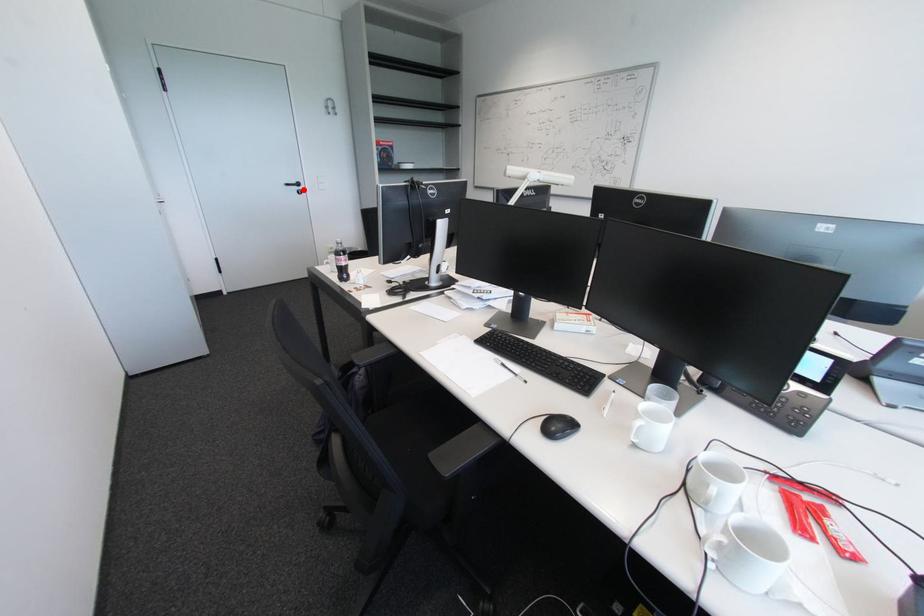
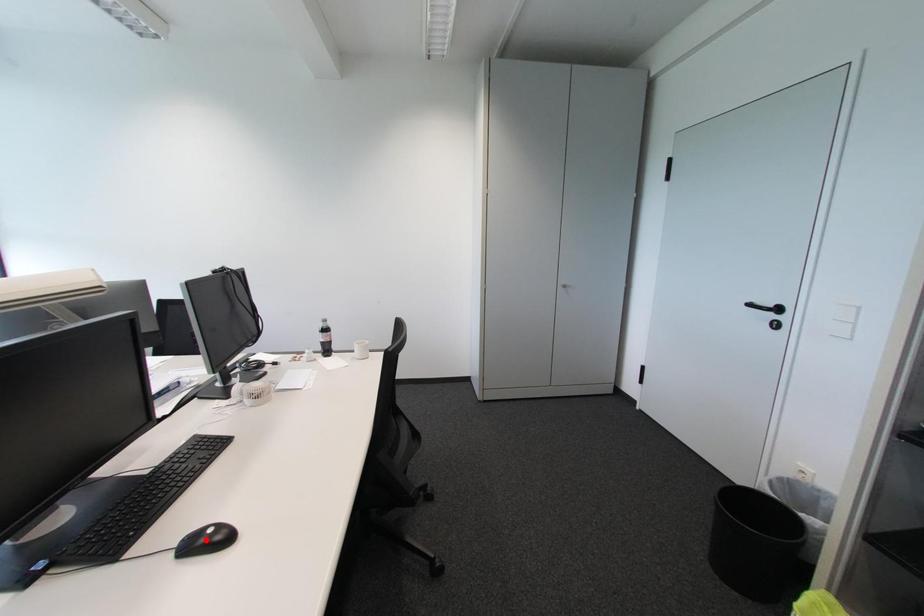
I am providing you with two images of the same scene from different viewpoints. A red point is marked on the first image and another point is marked on the second image. Is the marked point in image1 the same physical position as the marked point in image2?

No